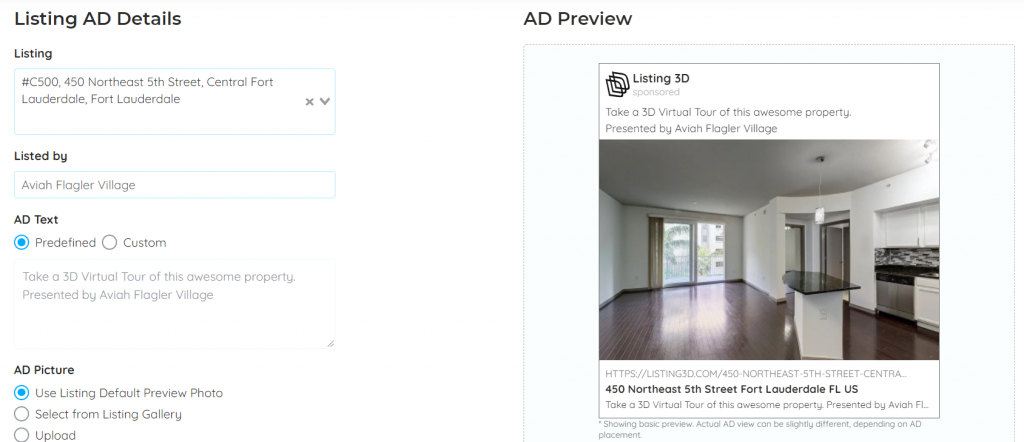
Locate an element on the screen. This screenshot has width=1024, height=442. light fixture is located at coordinates (820, 217).